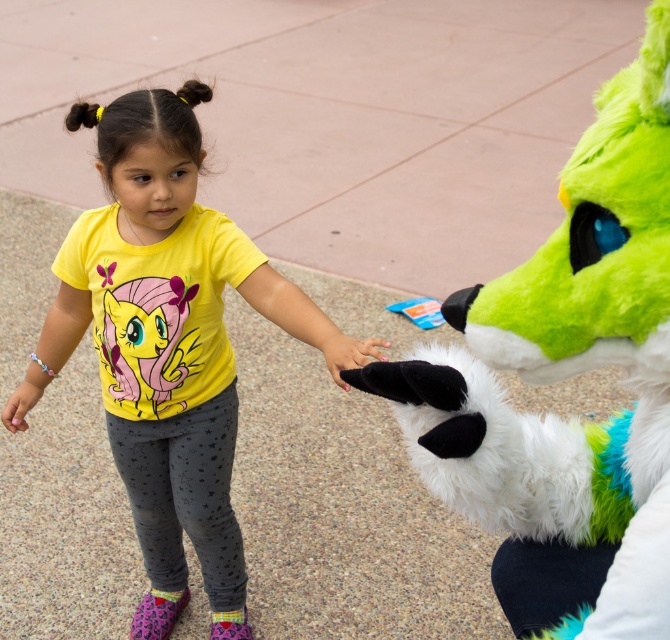
Question: Which of the following is the farthest from the observer?

Choices:
 (A) yellow matte t-shirt at center
 (B) fluffy green and white plush toy at right

Answer: (A)

Question: Which of the following is the closest to the observer?

Choices:
 (A) (180, 262)
 (B) (639, 452)

Answer: (B)

Question: Is fluffy green and white plush toy at right bigger than yellow matte t-shirt at center?

Choices:
 (A) no
 (B) yes

Answer: (A)

Question: Does fluffy green and white plush toy at right appear on the left side of yellow matte t-shirt at center?

Choices:
 (A) yes
 (B) no

Answer: (B)

Question: Can you confirm if fluffy green and white plush toy at right is positioned below yellow matte t-shirt at center?

Choices:
 (A) yes
 (B) no

Answer: (B)